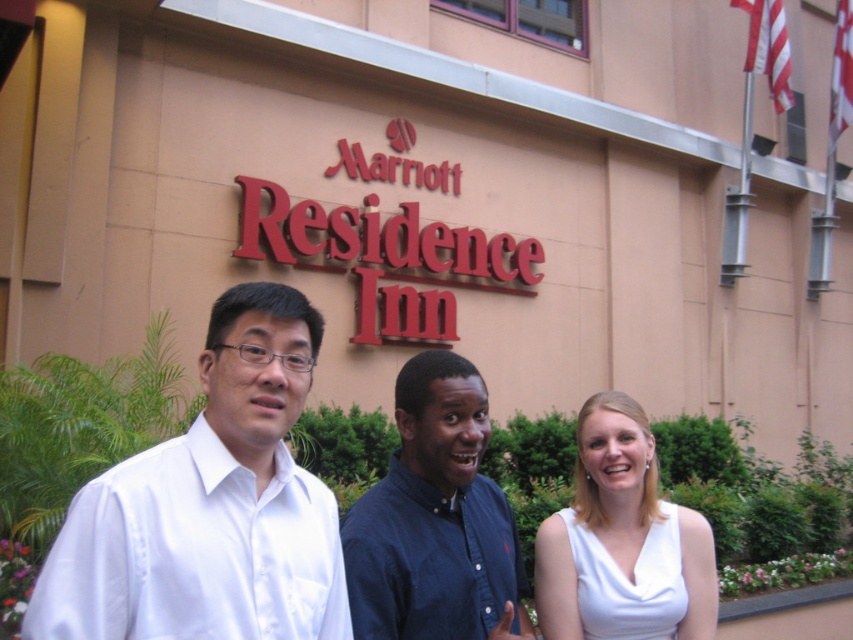
Question: Can you confirm if white satin shirt at center is positioned above white matte dress at center?

Choices:
 (A) no
 (B) yes

Answer: (B)

Question: Does blue button-down shirt at center have a lesser width compared to white matte dress at center?

Choices:
 (A) no
 (B) yes

Answer: (B)

Question: Which of the following is the closest to the observer?

Choices:
 (A) (149, 545)
 (B) (601, 420)

Answer: (A)

Question: Which object is the farthest from the white satin shirt at center?

Choices:
 (A) blue button-down shirt at center
 (B) white matte dress at center

Answer: (B)

Question: Does blue button-down shirt at center have a lesser width compared to white matte dress at center?

Choices:
 (A) yes
 (B) no

Answer: (A)

Question: Which point is farther to the camera?

Choices:
 (A) (698, 544)
 (B) (485, 570)
 (C) (51, 573)

Answer: (A)